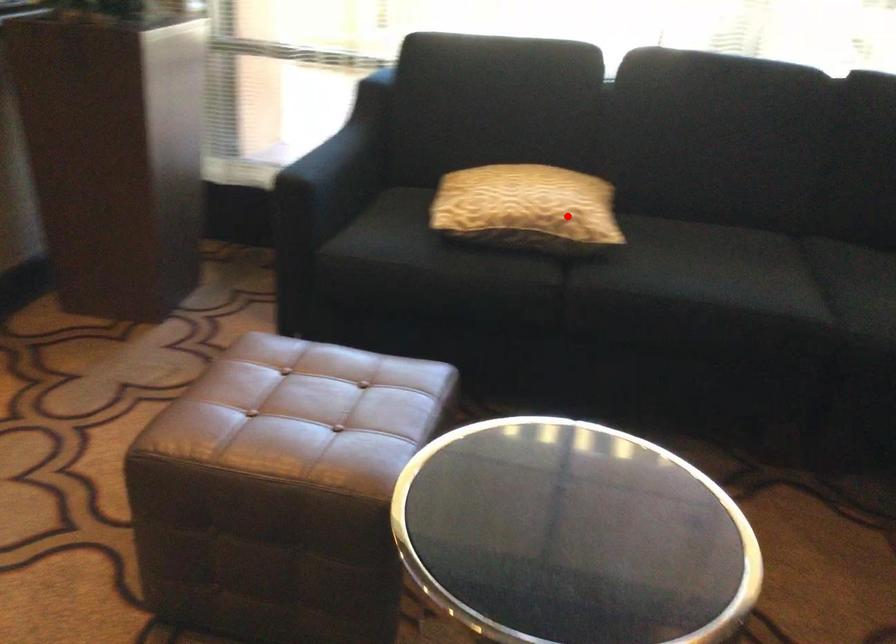
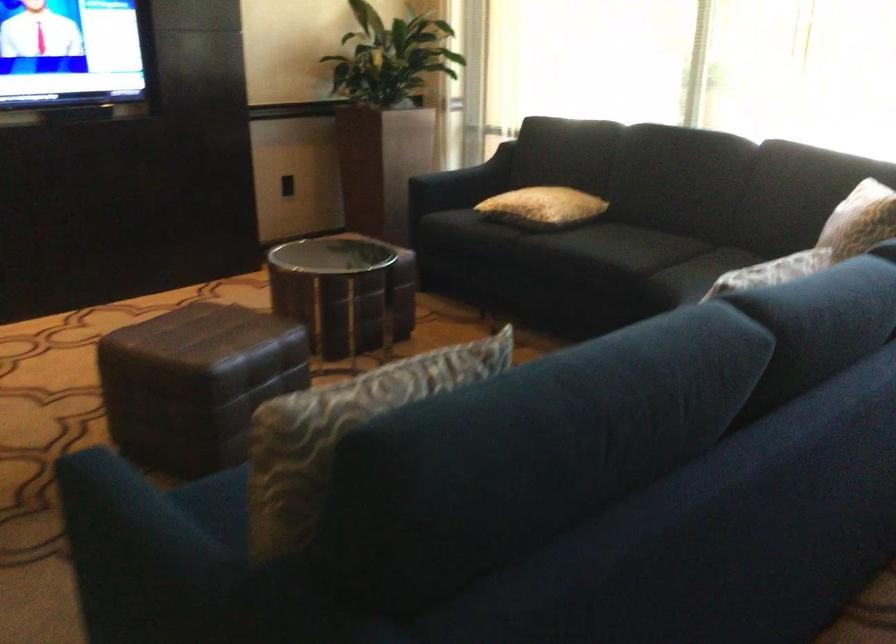
Question: A red point is marked in image1. In image2, is the corresponding 3D point closer to the camera or farther? Reply with the corresponding letter.

Choices:
 (A) The corresponding 3D point is closer.
 (B) The corresponding 3D point is farther.

Answer: (B)